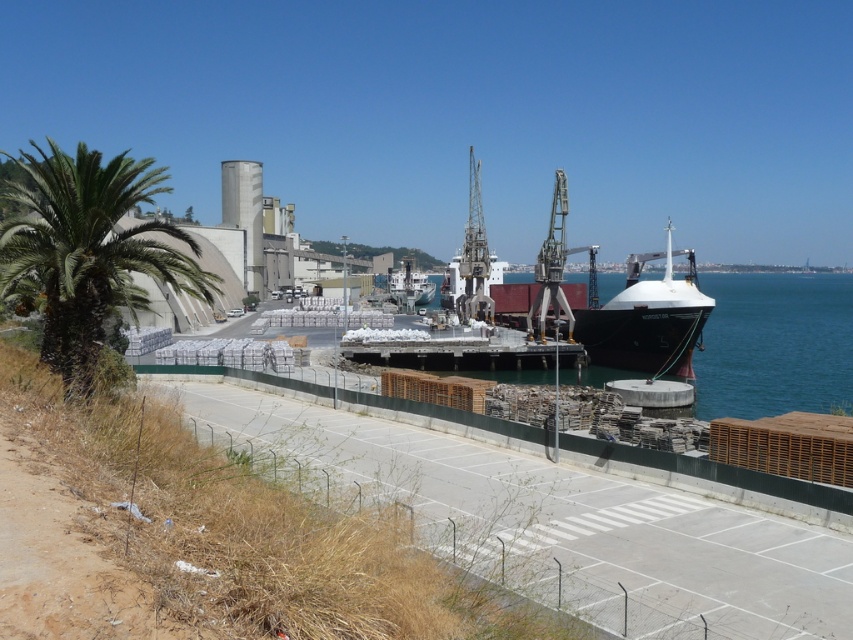
Which of these two, green leafy palm tree at left or white matte boat at center, stands shorter?

white matte boat at center

Which is below, green leafy palm tree at left or white matte boat at center?

Positioned lower is green leafy palm tree at left.

Between point (68, 308) and point (399, 300), which one is positioned behind?

Positioned behind is point (399, 300).

The width and height of the screenshot is (853, 640). What are the coordinates of `green leafy palm tree at left` in the screenshot? It's located at (88, 250).